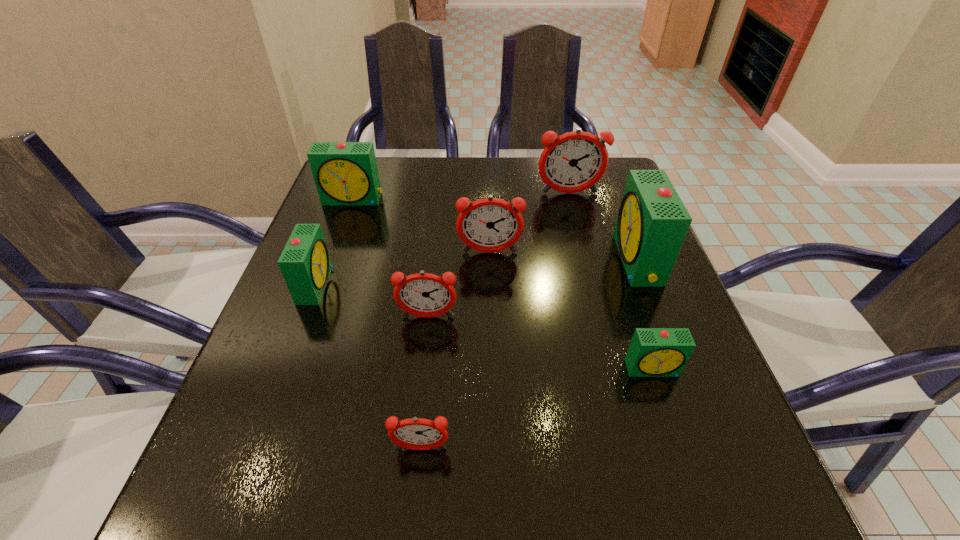
I want to click on the smallest green alarm clock, so click(653, 352).

This screenshot has height=540, width=960. In order to click on the second nearest alarm clock in this screenshot , I will do `click(653, 352)`.

You are a GUI agent. You are given a task and a screenshot of the screen. Output one action in this format:
    pyautogui.click(x=<x>, y=<y>)
    Task: Click on the vacant space located on the front-facing side of the biggest reddish-pink alarm clock
    
    Given the screenshot: What is the action you would take?
    pyautogui.click(x=577, y=226)

Identify the location of free space located on the front-facing side of the biggest green alarm clock. (438, 260).

Identify the location of vacant area situated on the front-facing side of the biggest green alarm clock. (561, 260).

The image size is (960, 540). What are the coordinates of `vacant area situated on the front-facing side of the biggest green alarm clock` in the screenshot? It's located at (529, 260).

Locate an element on the screen. The width and height of the screenshot is (960, 540). vacant space located 0.130m on the front-facing side of the second farthest reddish-pink alarm clock is located at coordinates pyautogui.click(x=491, y=301).

Image resolution: width=960 pixels, height=540 pixels. I want to click on vacant point located 0.360m on the front-facing side of the farthest green alarm clock, so click(x=312, y=314).

This screenshot has width=960, height=540. Identify the location of vacant space situated 0.350m on the front-facing side of the third farthest reddish-pink alarm clock. (405, 523).

The height and width of the screenshot is (540, 960). In order to click on vacant space located on the front-facing side of the third biggest green alarm clock in this screenshot , I will do `click(367, 284)`.